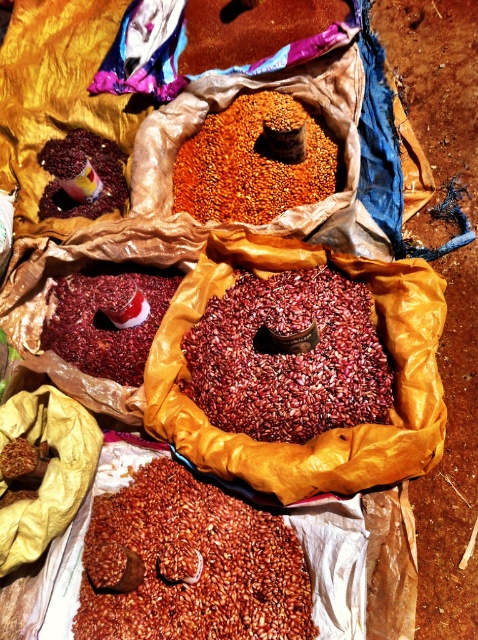
Which is in front, point (186, 472) or point (97, 173)?

Point (186, 472) is in front.

Which is in front, point (101, 577) or point (102, 148)?

Point (101, 577) is in front.

Locate an element on the screen. Image resolution: width=478 pixels, height=640 pixels. brown matte beans at center is located at coordinates (191, 564).

Does point (174, 189) come farther from viewer compared to point (51, 212)?

No, (174, 189) is closer to viewer.

Does golden grain at center have a larger size compared to shiny plastic cup at upper left?

Yes.

Is point (276, 205) farther from viewer compared to point (95, 205)?

No.

This screenshot has width=478, height=640. Identify the location of golden grain at center. (251, 163).

Who is lower down, dark red grain at center or matte red beans at center?

dark red grain at center is below.

Between point (339, 336) and point (83, 275), which one is positioned behind?

Positioned behind is point (83, 275).

Image resolution: width=478 pixels, height=640 pixels. Find the location of `dark red grain at center`. dark red grain at center is located at coordinates (288, 356).